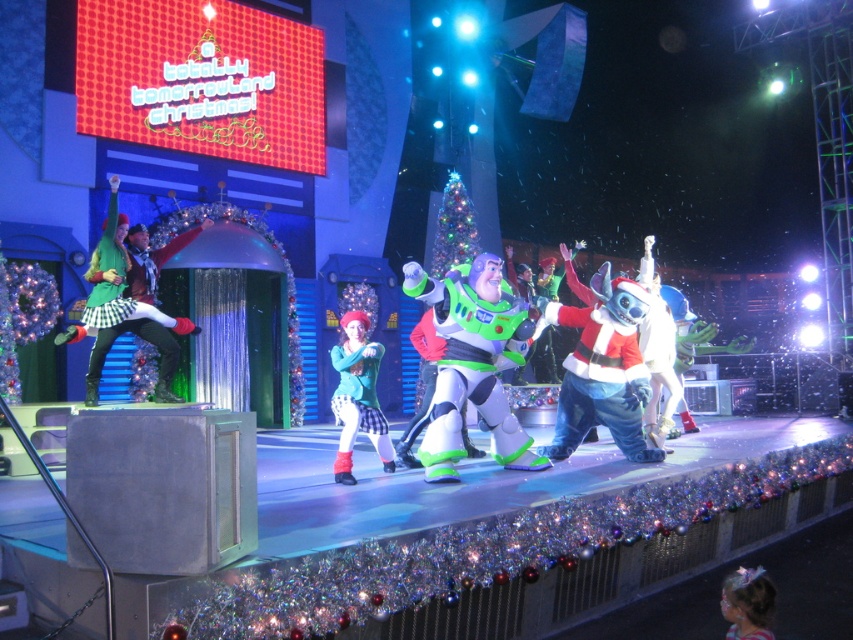
How distant is sparkly tinsel garland at stage front from white plush santa at center?

The distance of sparkly tinsel garland at stage front from white plush santa at center is 5.28 feet.

Describe the element at coordinates (483, 548) in the screenshot. I see `sparkly tinsel garland at stage front` at that location.

Who is more forward, (662, 490) or (469, 392)?

Point (662, 490) is more forward.

Find the location of a particular element. The width and height of the screenshot is (853, 640). sparkly tinsel garland at stage front is located at coordinates (483, 548).

Who is more forward, [604,326] or [764,605]?

Point [764,605] is more forward.

Does point (599, 320) lie behind point (749, 634)?

Yes, point (599, 320) is behind point (749, 634).

The image size is (853, 640). I want to click on white plush toy at center, so click(x=602, y=369).

Image resolution: width=853 pixels, height=640 pixels. Find the location of `green felt elf at left`. green felt elf at left is located at coordinates click(x=128, y=300).

Does point (171, 340) come farther from viewer compared to point (364, 376)?

Yes, it is.

Find the location of a particular element. This screenshot has height=640, width=853. green felt elf at left is located at coordinates coord(128,300).